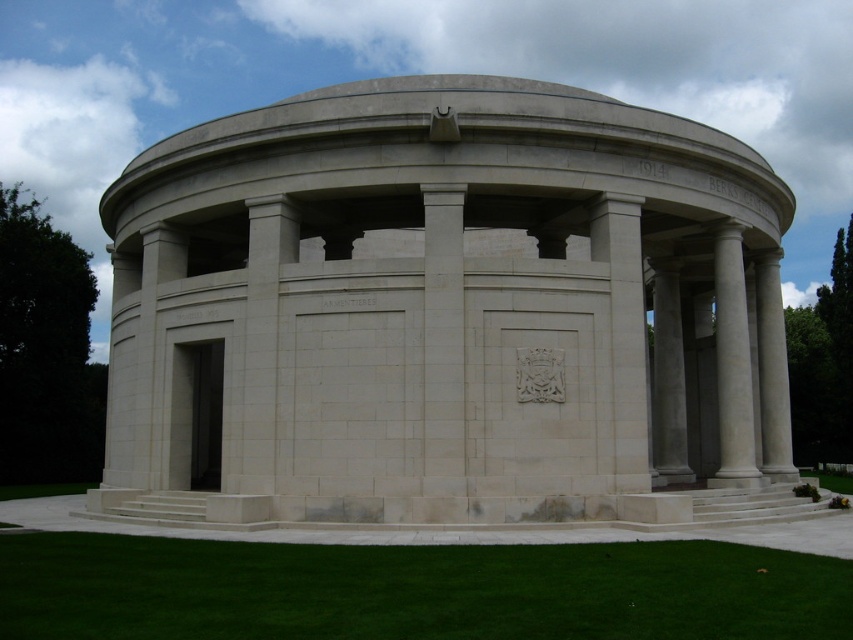
Can you confirm if green grass at lower center is thinner than white marble column at right?

In fact, green grass at lower center might be wider than white marble column at right.

What do you see at coordinates (415, 589) in the screenshot? I see `green grass at lower center` at bounding box center [415, 589].

This screenshot has width=853, height=640. In order to click on green grass at lower center in this screenshot , I will do `click(415, 589)`.

Who is more distant from viewer, (718,250) or (849,472)?

The point (849,472) is more distant.

Is white marble column at right below green grass at lower right?

Incorrect, white marble column at right is not positioned below green grass at lower right.

Is point (750, 438) farther from camera compared to point (817, 484)?

No.

This screenshot has width=853, height=640. What are the coordinates of `white marble column at right` in the screenshot? It's located at (732, 364).

What do you see at coordinates (437, 314) in the screenshot? I see `white stone gazebo at center` at bounding box center [437, 314].

Does white stone gazebo at center appear on the right side of white marble column at right?

Incorrect, white stone gazebo at center is not on the right side of white marble column at right.

Between point (671, 289) and point (722, 273), which one is positioned behind?

Point (671, 289)

Locate an element on the screen. The image size is (853, 640). white stone gazebo at center is located at coordinates (437, 314).